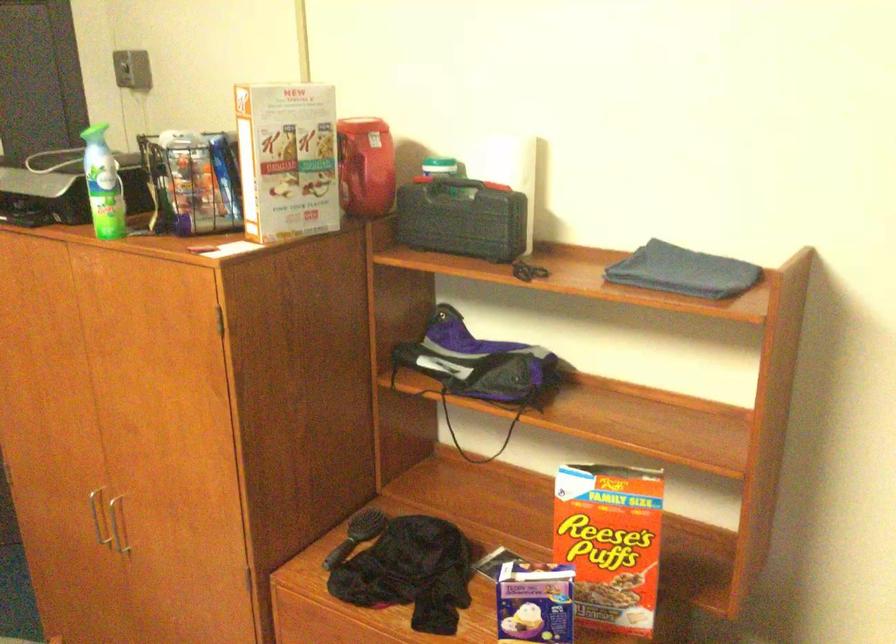
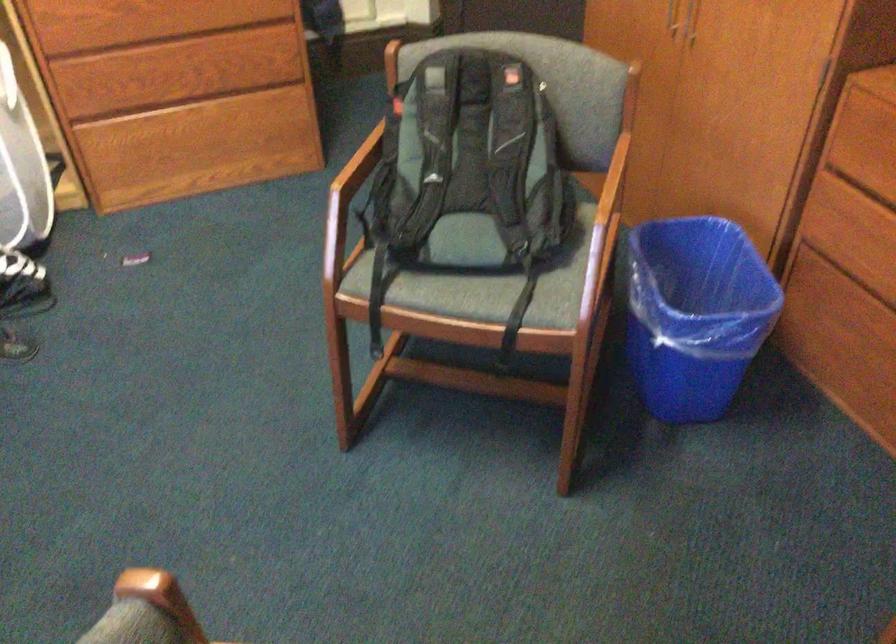
Find the pixel in the second image that matches point 99,534 in the first image.

(670, 17)